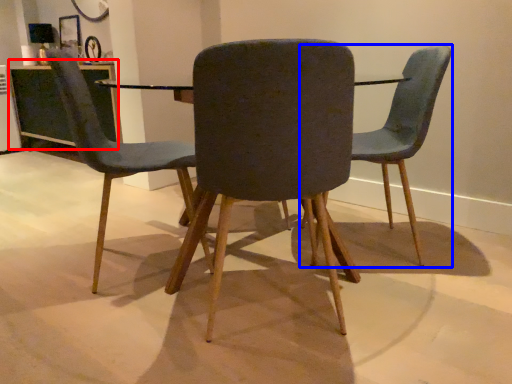
Question: Among these objects, which one is farthest to the camera, table (highlighted by a red box) or chair (highlighted by a blue box)?

Choices:
 (A) table
 (B) chair

Answer: (A)